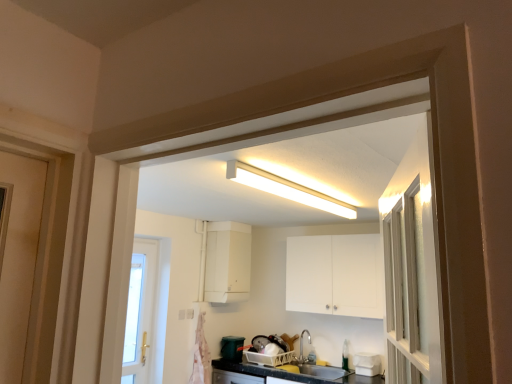
Question: From a real-world perspective, is white matte cabinet at upper center, marked as the second cabinetry in a left-to-right arrangement, positioned above or below white matte container at lower right?

Choices:
 (A) above
 (B) below

Answer: (A)

Question: Looking at their shapes, would you say white matte cabinet at upper center, which appears as the first cabinetry when viewed from the right, is wider or thinner than white matte container at lower right?

Choices:
 (A) wide
 (B) thin

Answer: (A)

Question: Which object is positioned closest to the white matte container at lower right?

Choices:
 (A) white fluorescent light at upper center
 (B) white matte cabinet at upper center, positioned as the 2th cabinetry in right-to-left order
 (C) satin nickel faucet at lower center
 (D) white matte cabinet at upper center, which appears as the first cabinetry when viewed from the right
 (E) white plastic electric outlet at lower center

Answer: (C)

Question: Which object is positioned farthest from the white fluorescent light at upper center?

Choices:
 (A) white matte container at lower right
 (B) white matte cabinet at upper center, which appears as the first cabinetry when viewed from the right
 (C) white plastic electric outlet at lower center
 (D) satin nickel faucet at lower center
 (E) white matte cabinet at upper center, positioned as the 2th cabinetry in right-to-left order

Answer: (D)